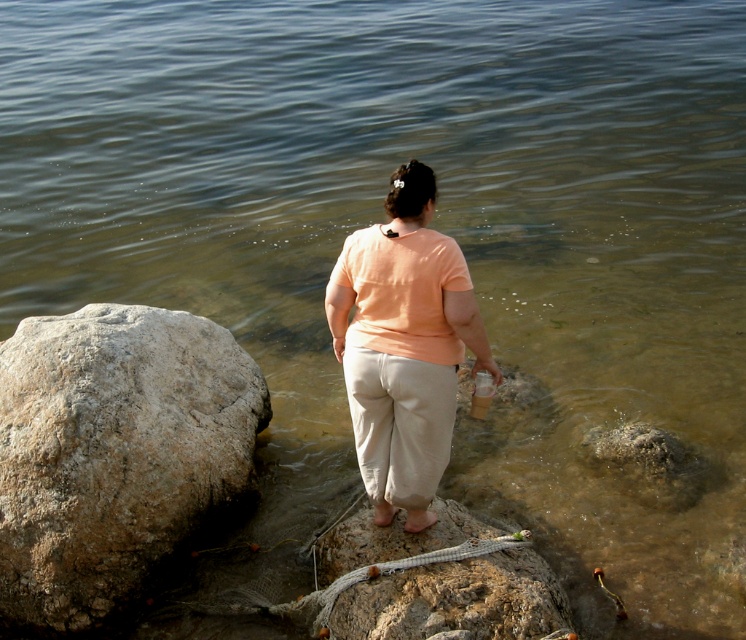
You are standing at the point marked as point (244, 353) on the rocky shoreline. You want to throw a small stone to the water surface. What is the minimum distance you need to throw the stone to reach the water?

The minimum distance you need to throw the stone is 6.50 meters to reach the water from point (244, 353).

You are a photographer standing at the shoreline and want to capture both the point at point (37, 579) and the point at point (445, 605) in your photo. Which point will appear closer to the camera in the final image?

The point at point (37, 579) will appear closer to the camera in the final image because it is further to the viewer than point (445, 605).